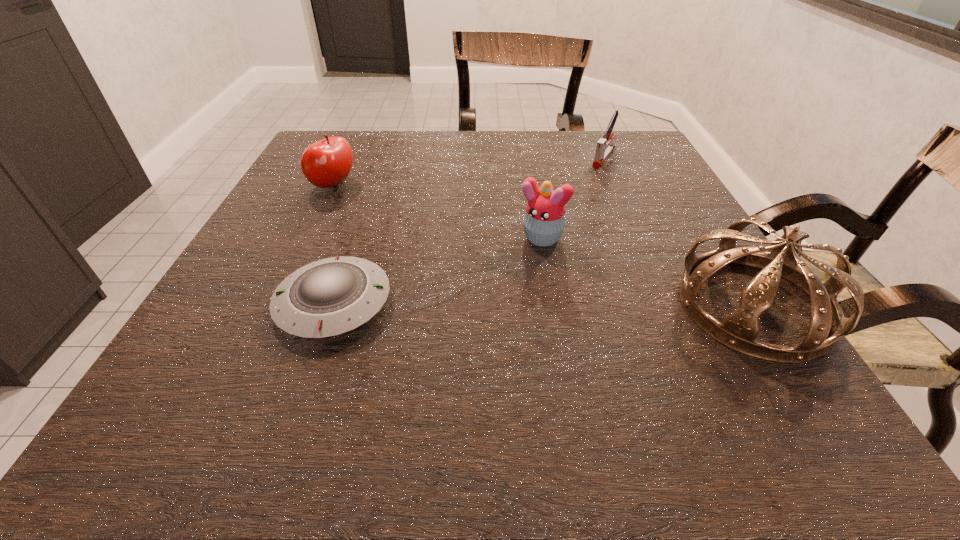
I want to click on vacant space located on the handle side of the farthest object, so click(543, 235).

This screenshot has width=960, height=540. I want to click on vacant region located on the handle side of the farthest object, so click(x=587, y=183).

In order to click on free space located on the face of the third object from right to left in this screenshot , I will do 481,314.

Locate an element on the screen. The width and height of the screenshot is (960, 540). free space located 0.290m on the face of the third object from right to left is located at coordinates (449, 359).

The width and height of the screenshot is (960, 540). What are the coordinates of `vacant space located on the face of the third object from right to left` in the screenshot? It's located at (497, 292).

The image size is (960, 540). In order to click on free spot located on the stem of the apple in this screenshot , I will do `click(370, 206)`.

Identify the location of free location located on the stem of the apple. This screenshot has height=540, width=960. (x=398, y=221).

The height and width of the screenshot is (540, 960). Find the location of `free location located 0.330m on the stem of the apple`. free location located 0.330m on the stem of the apple is located at coordinates (457, 252).

The width and height of the screenshot is (960, 540). What are the coordinates of `stapler located at the far edge` in the screenshot? It's located at tap(604, 148).

What are the coordinates of `apple that is at the far edge` in the screenshot? It's located at (326, 163).